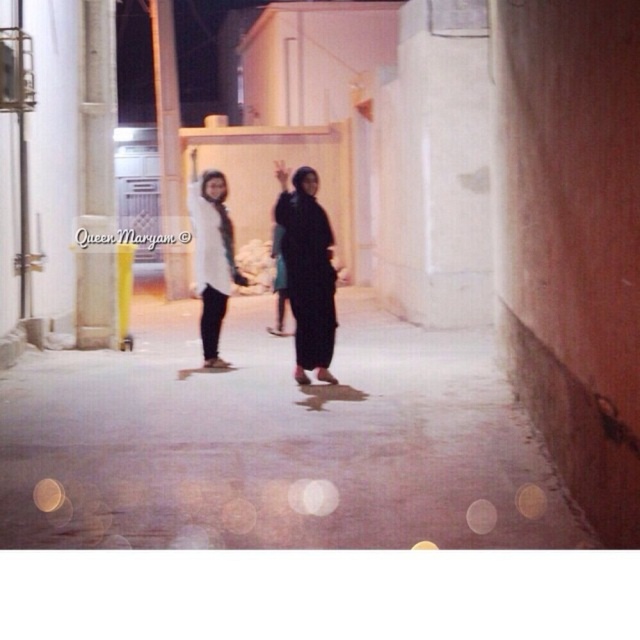
You are a photographer trying to capture a clear shot of both the black matte hijab at center and the white matte shirt at center in the alleyway. Since the lighting is limited, you want to position your camera to focus on the object that is closer to the light source. Which object should you focus on?

The black matte hijab at center is to the right of white matte shirt at center. However, the description does not provide information about their distance from the light source. Therefore, it is impossible to determine which object is closer to the light source based on the given information.

You are a photographer setting up for a photoshoot in a narrow alleyway at night. You have two outfits to place in the center of the scene. The matte black dress at center and the white matte shirt at center. Which outfit takes up less space in the scene?

The matte black dress at center is smaller than the white matte shirt at center, so it takes up less space in the scene.

You are a photographer trying to position a matte black dress at center for a photoshoot in a narrow alleyway. The alley has concrete walls and a damp ground. Where should you place the dress to match the scene?

The matte black dress at center should be placed at point coordinates of (307, 269) to match the scene.